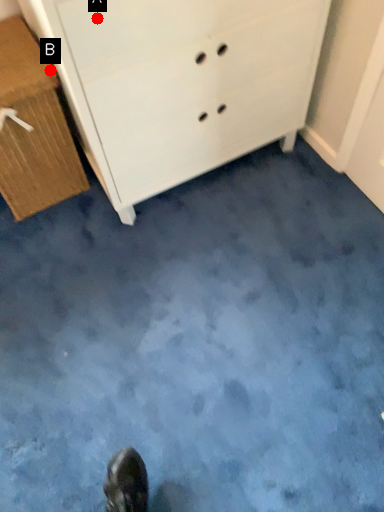
Question: Two points are circled on the image, labeled by A and B beside each circle. Which point is closer to the camera?

Choices:
 (A) A is closer
 (B) B is closer

Answer: (A)